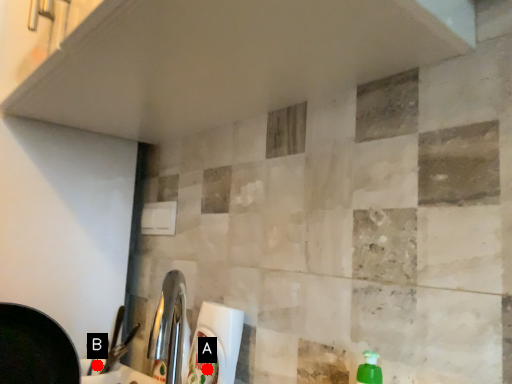
Question: Two points are circled on the image, labeled by A and B beside each circle. Which point is farther to the camera?

Choices:
 (A) A is further
 (B) B is further

Answer: (B)